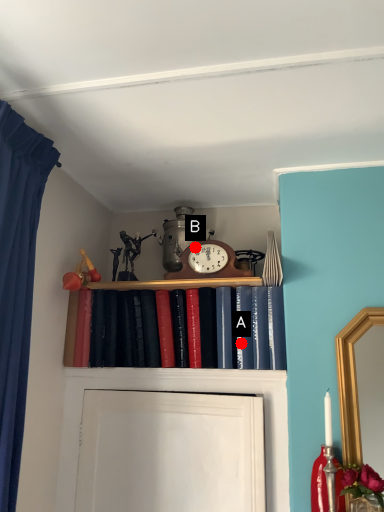
Question: Two points are circled on the image, labeled by A and B beside each circle. Which point appears closest to the camera in this image?

Choices:
 (A) A is closer
 (B) B is closer

Answer: (A)